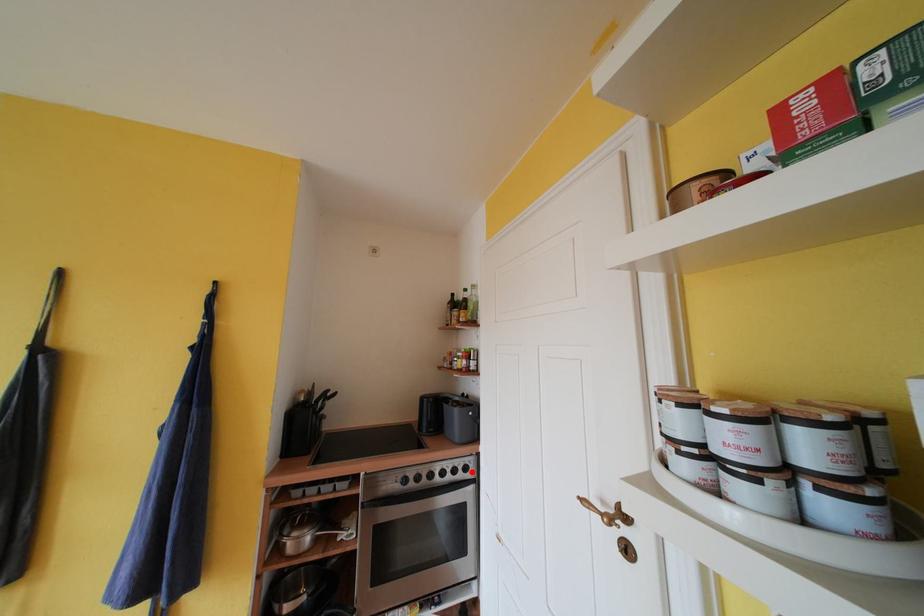
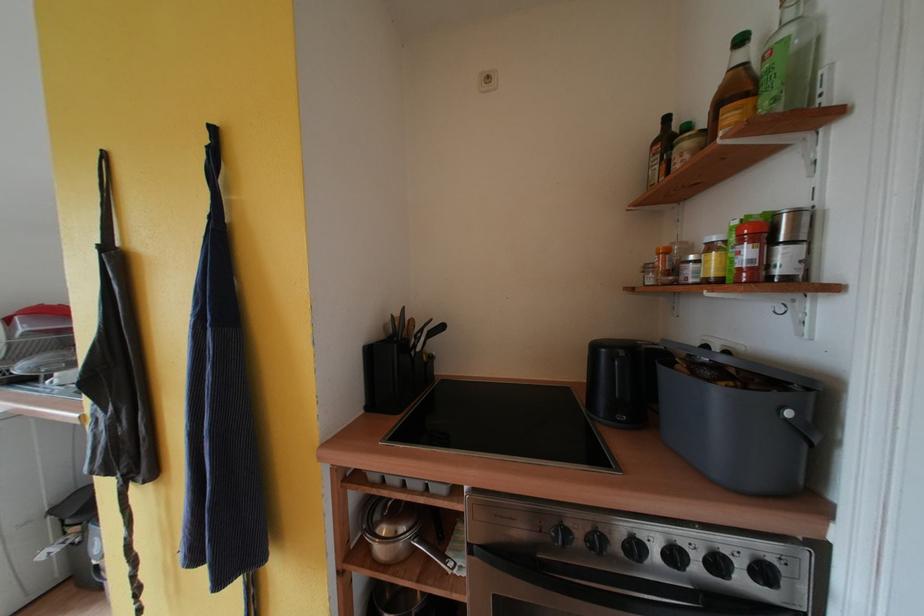
Question: I am providing you with two images of the same scene from different viewpoints. Image1 has a red point marked. In image2, the corresponding 3D location appears at what relative position? Reply with the corresponding letter.

Choices:
 (A) Closer
 (B) Farther

Answer: (A)